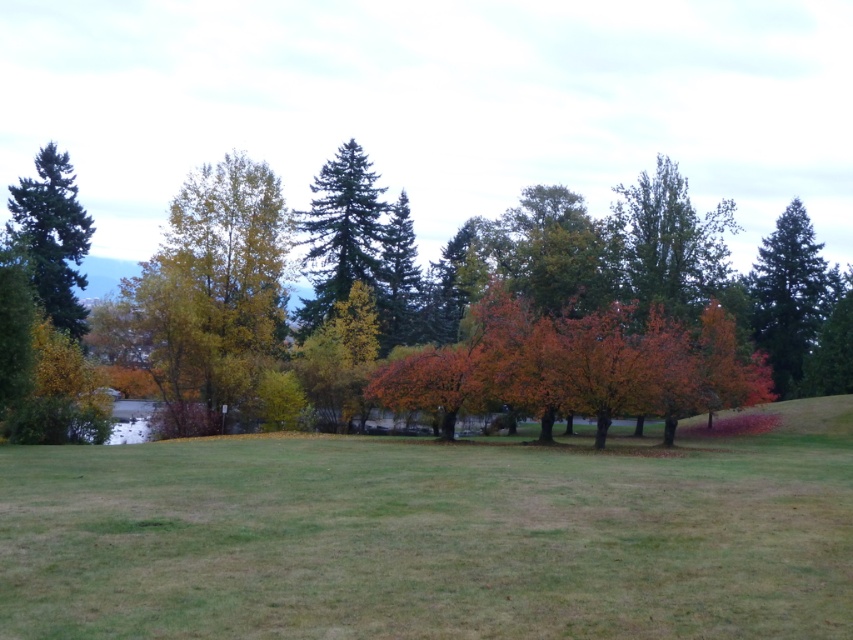
Question: Does autumn leaves tree at center have a lesser width compared to green matte evergreen tree at left?

Choices:
 (A) yes
 (B) no

Answer: (B)

Question: Does green matte tree at right appear over green matte evergreen tree at left?

Choices:
 (A) no
 (B) yes

Answer: (A)

Question: From the image, what is the correct spatial relationship of green coniferous tree at center in relation to green matte tree at right?

Choices:
 (A) above
 (B) below

Answer: (A)

Question: Estimate the real-world distances between objects in this image. Which object is farther from the autumn leaves tree at center?

Choices:
 (A) green coniferous tree at center
 (B) green matte tree at right
 (C) green matte evergreen tree at left

Answer: (C)

Question: Estimate the real-world distances between objects in this image. Which object is farther from the autumn leaves tree at center?

Choices:
 (A) green matte evergreen tree at left
 (B) green coniferous tree at center

Answer: (A)

Question: Which object appears closest to the camera in this image?

Choices:
 (A) green coniferous tree at center
 (B) green matte tree at right

Answer: (A)